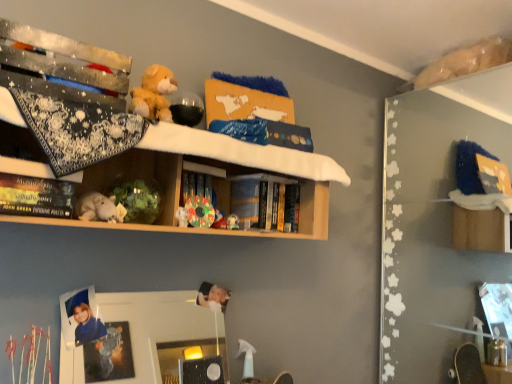
Question: Visually, is white plush toy at center, the third toy from the right, positioned to the left or to the right of hardcover book at center, which ranks as the second book in front-to-back order?

Choices:
 (A) right
 (B) left

Answer: (B)

Question: Is point (80, 218) closer or farther from the camera than point (265, 213)?

Choices:
 (A) closer
 (B) farther

Answer: (A)

Question: Which object is the closest to the hardcover book at center, placed as the 1th book when sorted from right to left?

Choices:
 (A) hardcover book at upper left, the 2th book when ordered from back to front
 (B) multicolored plastic toy at center, the 1th toy when ordered from right to left
 (C) clear glass mirror at center
 (D) wooden shelf at upper center
 (E) white plush toy at center, the third toy from the right

Answer: (D)

Question: Which object is the closest to the white plush toy at center, which is the third toy from back to front?

Choices:
 (A) hardcover book at center, placed as the 1th book when sorted from right to left
 (B) translucent plastic toy at center, which is the 2th toy from left to right
 (C) hardcover book at upper left, which ranks as the 1th book in front-to-back order
 (D) clear glass mirror at center
 (E) wooden shelf at upper center

Answer: (C)